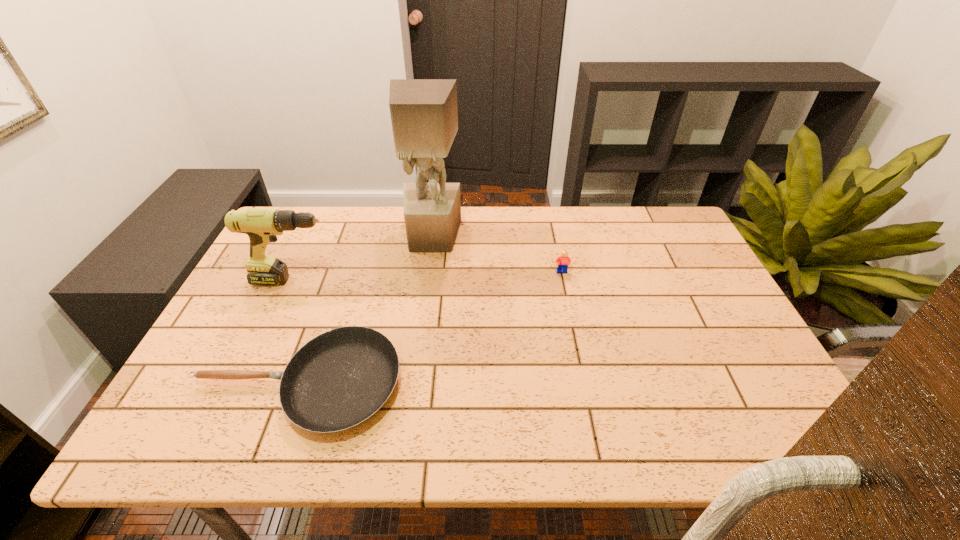
Locate an element on the screen. vacant area situated 0.080m on the back of the nearest object is located at coordinates (324, 313).

At what (x,y) coordinates should I click in order to perform the action: click on object at the far edge. Please return your answer as a coordinate pair (x, y). This screenshot has height=540, width=960. Looking at the image, I should click on (424, 115).

You are a GUI agent. You are given a task and a screenshot of the screen. Output one action in this format:
    pyautogui.click(x=<x>, y=<y>)
    Task: Click on the object present at the near edge
    The height and width of the screenshot is (540, 960).
    Given the screenshot: What is the action you would take?
    tap(337, 380)

Where is `drill that is at the left edge`? The width and height of the screenshot is (960, 540). drill that is at the left edge is located at coordinates (262, 225).

Where is `frying pan that is at the left edge`? The height and width of the screenshot is (540, 960). frying pan that is at the left edge is located at coordinates (337, 380).

Where is `object positioned at the near left corner`? This screenshot has height=540, width=960. object positioned at the near left corner is located at coordinates (337, 380).

The width and height of the screenshot is (960, 540). What are the coordinates of `free region at the far edge` in the screenshot? It's located at (564, 233).

Find the location of `vacant space at the near edge of the desktop`. vacant space at the near edge of the desktop is located at coordinates 452,413.

This screenshot has height=540, width=960. In the image, there is a desktop. Identify the location of free space at the left edge. (252, 294).

I want to click on vacant space at the right edge, so click(x=685, y=344).